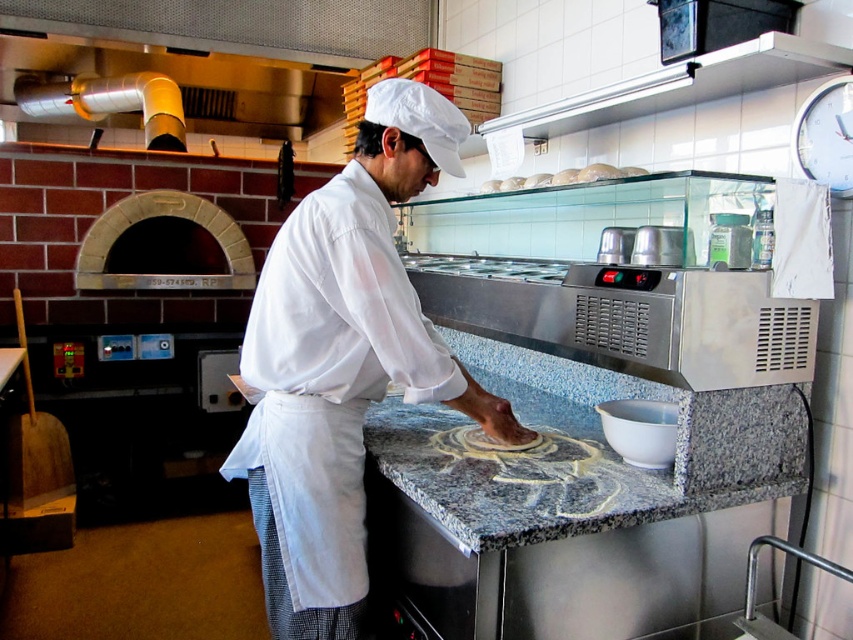
You are a chef who wants to reach the white matte bread at upper center while standing at the white cotton apron at center. Can you grab it without moving your feet?

The distance between the white cotton apron at center and the white matte bread at upper center is 32.53 inches, which is approximately 2.7 feet. Since this distance is within an average person arm reach, you can grab the white matte bread at upper center without moving your feet.

You are a chef in the kitchen and need to place a new ingredient on the counter between the white cotton apron at center and the white matte bread at upper center. Considering their heights, which object should you place the ingredient closer to?

The white cotton apron at center is taller than the white matte bread at upper center. To place the ingredient between them, you should position it closer to the white matte bread at upper center to avoid blocking the taller apron.

You are a chef in a professional kitchen. You need to determine which item is larger between the white cotton apron at center and the white matte bread at upper center. Which one is bigger?

The white cotton apron at center is bigger than the white matte bread at upper center.